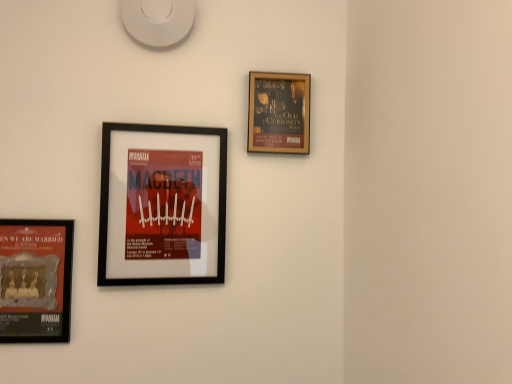
Question: Does black matte picture frame at center-left, which is the 2th picture frame in right-to-left order, appear on the left side of matte black poster at lower left, which is counted as the third picture frame, starting from the right?

Choices:
 (A) no
 (B) yes

Answer: (A)

Question: Is black matte picture frame at center-left, which is the 2th picture frame in right-to-left order, in front of matte black poster at lower left, which is the first picture frame from left to right?

Choices:
 (A) yes
 (B) no

Answer: (B)

Question: Is black matte picture frame at center-left, which is the 2th picture frame in right-to-left order, thinner than matte black poster at lower left, which is the first picture frame from left to right?

Choices:
 (A) no
 (B) yes

Answer: (A)

Question: Would you say black matte picture frame at center-left, placed as the second picture frame when sorted from left to right, is a long distance from matte black poster at lower left, which is counted as the third picture frame, starting from the right?

Choices:
 (A) no
 (B) yes

Answer: (A)

Question: Would you say black matte picture frame at center-left, which is the 2th picture frame in right-to-left order, is outside matte black poster at lower left, which is the first picture frame from left to right?

Choices:
 (A) yes
 (B) no

Answer: (A)

Question: Does black matte picture frame at center-left, placed as the second picture frame when sorted from left to right, have a larger size compared to matte black poster at lower left, which is the first picture frame from left to right?

Choices:
 (A) no
 (B) yes

Answer: (B)

Question: Is gold-framed poster at upper right, which appears as the first picture frame when viewed from the right, shorter than black matte picture frame at center-left, placed as the second picture frame when sorted from left to right?

Choices:
 (A) yes
 (B) no

Answer: (A)

Question: Is gold-framed poster at upper right, which appears as the third picture frame when viewed from the left, wider than black matte picture frame at center-left, which is the 2th picture frame in right-to-left order?

Choices:
 (A) no
 (B) yes

Answer: (A)

Question: Is gold-framed poster at upper right, which appears as the first picture frame when viewed from the right, at the left side of black matte picture frame at center-left, placed as the second picture frame when sorted from left to right?

Choices:
 (A) no
 (B) yes

Answer: (A)

Question: Is gold-framed poster at upper right, which appears as the third picture frame when viewed from the left, positioned before black matte picture frame at center-left, which is the 2th picture frame in right-to-left order?

Choices:
 (A) no
 (B) yes

Answer: (A)

Question: Is gold-framed poster at upper right, which appears as the first picture frame when viewed from the right, facing towards black matte picture frame at center-left, placed as the second picture frame when sorted from left to right?

Choices:
 (A) no
 (B) yes

Answer: (A)

Question: Does gold-framed poster at upper right, which appears as the third picture frame when viewed from the left, lie behind black matte picture frame at center-left, placed as the second picture frame when sorted from left to right?

Choices:
 (A) no
 (B) yes

Answer: (B)

Question: Can you confirm if matte black poster at lower left, which is counted as the third picture frame, starting from the right, is wider than gold-framed poster at upper right, which appears as the first picture frame when viewed from the right?

Choices:
 (A) no
 (B) yes

Answer: (A)